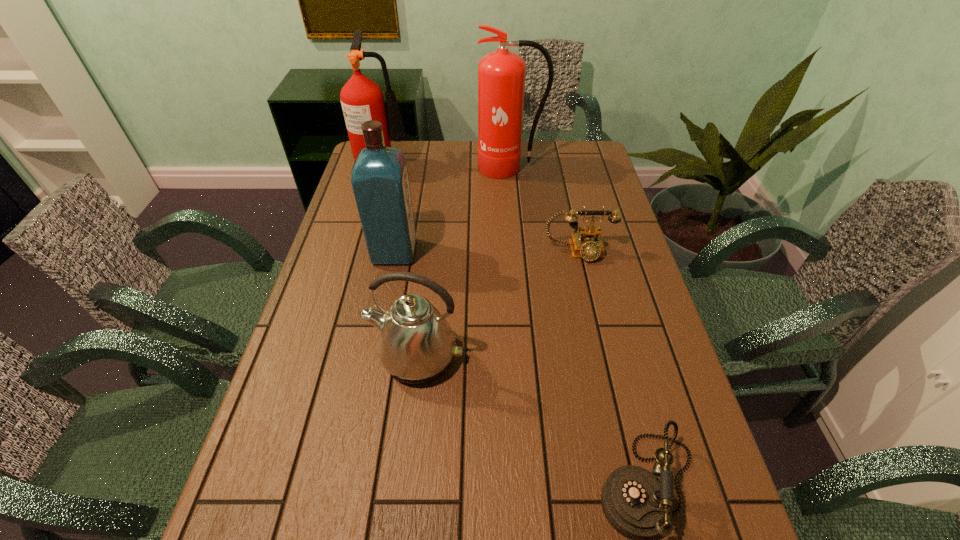
You are a GUI agent. You are given a task and a screenshot of the screen. Output one action in this format:
    pyautogui.click(x=<x>, y=<y>)
    Task: Click on the free spot that satisfies the following two spatial constraints: 1. at the nozzle of the left fire extinguisher; 2. on the right side of the kettle
    
    Given the screenshot: What is the action you would take?
    pyautogui.click(x=332, y=357)

In order to click on vacant space that satisfies the following two spatial constraints: 1. at the nozzle of the left fire extinguisher; 2. on the back side of the kettle in this screenshot , I will do `click(332, 357)`.